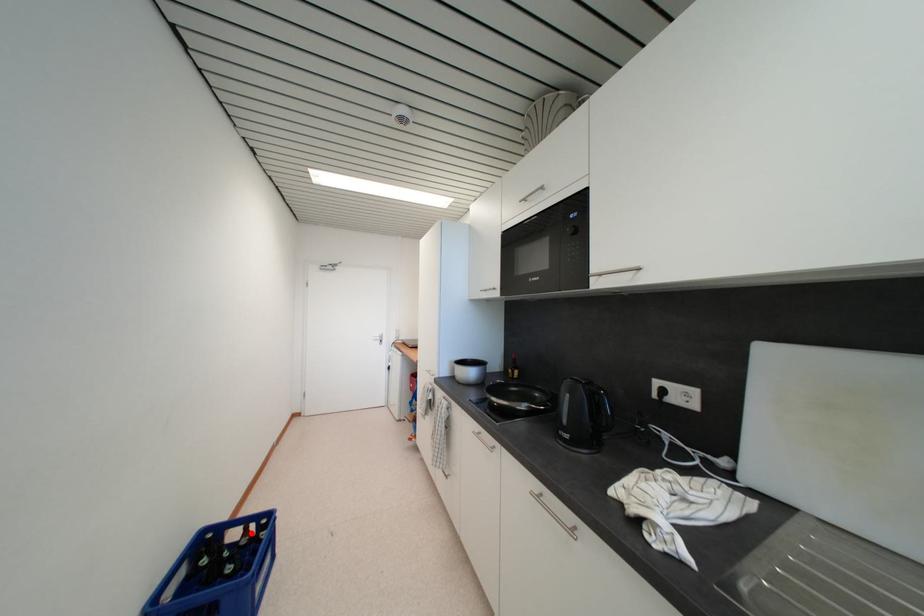
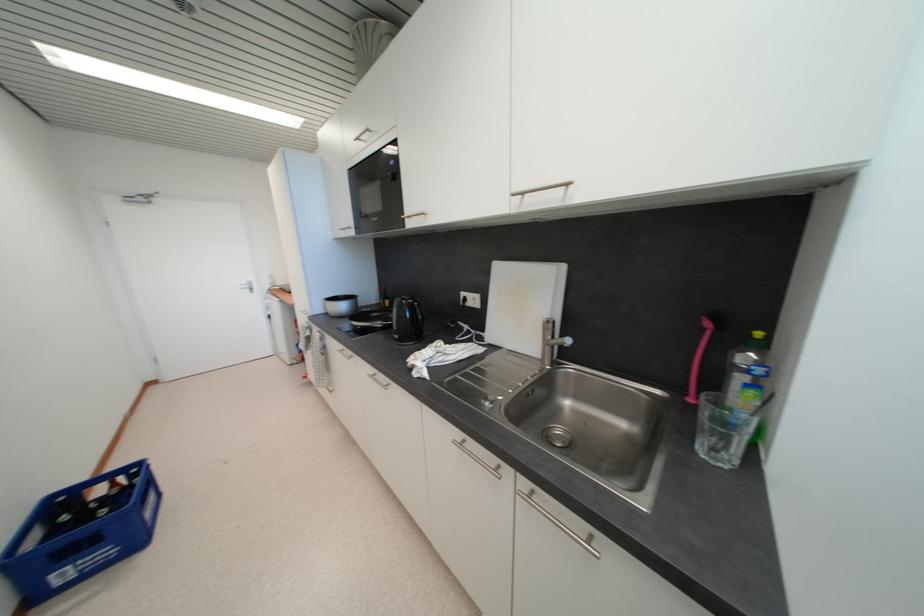
Find the pixel in the second image that matches the highlighted location in the first image.

(118, 487)